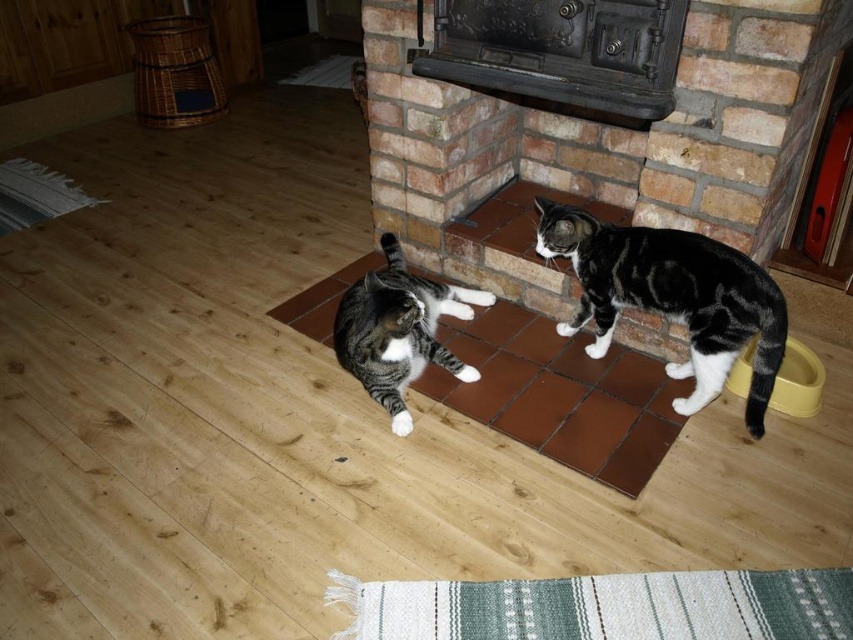
Where is `green woven mat at lower center`? This screenshot has height=640, width=853. green woven mat at lower center is located at coordinates [x=605, y=605].

Where is `green woven mat at lower center`? The image size is (853, 640). green woven mat at lower center is located at coordinates (605, 605).

Between point (335, 637) and point (653, 435), which one is positioned behind?

Positioned behind is point (653, 435).

Can you confirm if green woven mat at lower center is positioned to the right of brown tile mat at center?

Yes, green woven mat at lower center is to the right of brown tile mat at center.

Locate an element on the screen. The height and width of the screenshot is (640, 853). green woven mat at lower center is located at coordinates (605, 605).

Who is taller, black metal fireplace at center or tabby fur cat at right?

With more height is black metal fireplace at center.

Who is lower down, black metal fireplace at center or tabby fur cat at right?

Positioned lower is tabby fur cat at right.

Which is behind, point (480, 278) or point (630, 298)?

The point (480, 278) is behind.

Locate an element on the screen. The height and width of the screenshot is (640, 853). black metal fireplace at center is located at coordinates (474, 152).